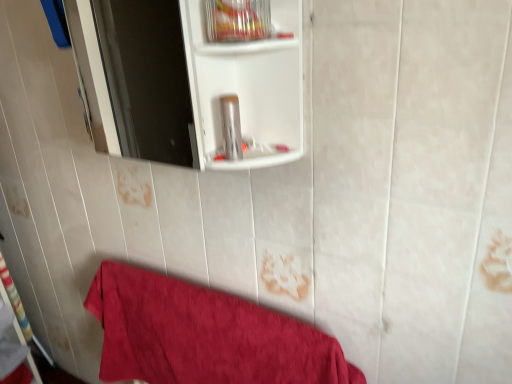
I want to click on red cotton towel at lower left, so click(204, 335).

Where is `silver metallic canister at center`? silver metallic canister at center is located at coordinates (231, 127).

Is clear plastic container at upper center looking in the opposite direction of silver metallic canister at center?

No.

Is clear plastic container at upper center wider than silver metallic canister at center?

Correct, the width of clear plastic container at upper center exceeds that of silver metallic canister at center.

From the image's perspective, is clear plastic container at upper center positioned above or below silver metallic canister at center?

Clearly, from the image's perspective, clear plastic container at upper center is above silver metallic canister at center.

Considering the positions of points (232, 349) and (236, 123), is point (232, 349) farther from camera compared to point (236, 123)?

Yes, point (232, 349) is behind point (236, 123).

From a real-world perspective, is red cotton towel at lower left located higher than silver metallic canister at center?

Actually, red cotton towel at lower left is physically below silver metallic canister at center in the real world.

The height and width of the screenshot is (384, 512). I want to click on towel behind the silver metallic canister at center, so click(x=204, y=335).

Looking at their sizes, would you say red cotton towel at lower left is wider or thinner than clear plastic container at upper center?

Considering their sizes, red cotton towel at lower left looks broader than clear plastic container at upper center.

Is red cotton towel at lower left completely or partially outside of clear plastic container at upper center?

Indeed, red cotton towel at lower left is completely outside clear plastic container at upper center.

Is red cotton towel at lower left positioned far away from clear plastic container at upper center?

No, red cotton towel at lower left is not far away from clear plastic container at upper center.

From a real-world perspective, is red cotton towel at lower left physically located above or below clear plastic container at upper center?

In terms of real-world spatial position, red cotton towel at lower left is below clear plastic container at upper center.

Consider the image. Is silver metallic canister at center far away from red cotton towel at lower left?

They are positioned close to each other.

Is red cotton towel at lower left located within silver metallic canister at center?

Actually, red cotton towel at lower left is outside silver metallic canister at center.

Is silver metallic canister at center oriented away from red cotton towel at lower left?

No, red cotton towel at lower left is not at the back of silver metallic canister at center.

Is silver metallic canister at center aimed at clear plastic container at upper center?

No, silver metallic canister at center is not turned towards clear plastic container at upper center.

Is silver metallic canister at center to the left of clear plastic container at upper center from the viewer's perspective?

Yes, silver metallic canister at center is to the left of clear plastic container at upper center.

Is clear plastic container at upper center next to red cotton towel at lower left?

No, clear plastic container at upper center is not touching red cotton towel at lower left.

From a real-world perspective, does clear plastic container at upper center stand above red cotton towel at lower left?

Yes, from a real-world perspective, clear plastic container at upper center is above red cotton towel at lower left.

Considering their positions, is clear plastic container at upper center located in front of or behind red cotton towel at lower left?

clear plastic container at upper center is in front of red cotton towel at lower left.

How different are the orientations of clear plastic container at upper center and red cotton towel at lower left in degrees?

There is a 2.03-degree angle between the facing directions of clear plastic container at upper center and red cotton towel at lower left.

The image size is (512, 384). What are the coordinates of `cabinet that is in front of the silver metallic canister at center` in the screenshot? It's located at (246, 46).

You are a GUI agent. You are given a task and a screenshot of the screen. Output one action in this format:
    pyautogui.click(x=<x>, y=<y>)
    Task: Click on the towel that is below the silver metallic canister at center (from the image's perspective)
    
    Given the screenshot: What is the action you would take?
    pyautogui.click(x=204, y=335)

Considering their positions, is clear plastic container at upper center positioned further to silver metallic canister at center than red cotton towel at lower left?

red cotton towel at lower left.

Based on the photo, estimate the real-world distances between objects in this image. Which object is further from clear plastic container at upper center, silver metallic canister at center or red cotton towel at lower left?

Based on the image, red cotton towel at lower left appears to be further to clear plastic container at upper center.

Considering their positions, is silver metallic canister at center positioned further to red cotton towel at lower left than clear plastic container at upper center?

clear plastic container at upper center lies further to red cotton towel at lower left than the other object.

Based on the photo, from the image, which object appears to be farther from red cotton towel at lower left, clear plastic container at upper center or silver metallic canister at center?

clear plastic container at upper center is further to red cotton towel at lower left.

From the image, which object appears to be nearer to silver metallic canister at center, red cotton towel at lower left or clear plastic container at upper center?

The object closer to silver metallic canister at center is clear plastic container at upper center.

Considering their positions, is red cotton towel at lower left positioned closer to clear plastic container at upper center than silver metallic canister at center?

silver metallic canister at center is closer to clear plastic container at upper center.

This screenshot has height=384, width=512. Identify the location of toiletry between clear plastic container at upper center and red cotton towel at lower left from top to bottom. (231, 127).